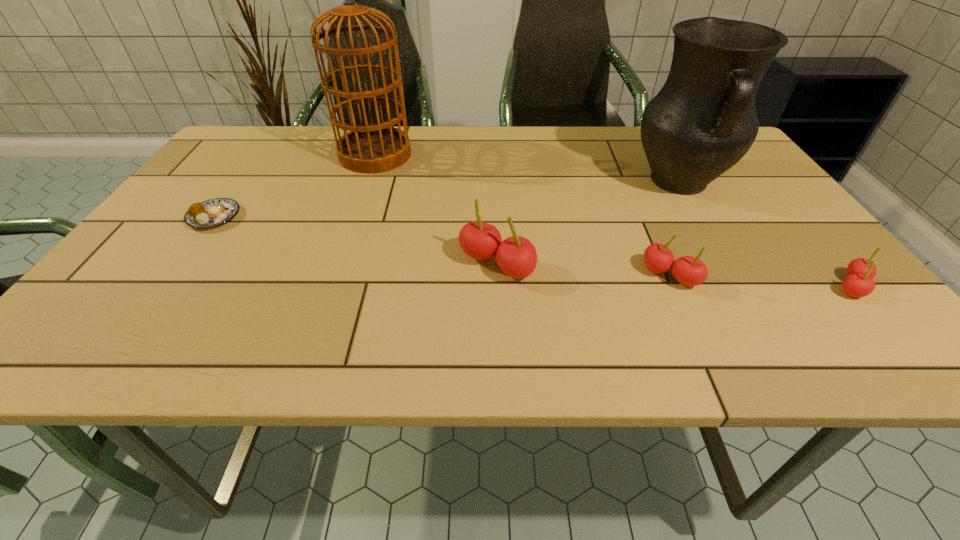
Find the location of a particular element. The image size is (960, 540). pastry is located at coordinates (210, 213).

Where is `vacant space located 0.060m on the right of the tallest cherry`? Image resolution: width=960 pixels, height=540 pixels. vacant space located 0.060m on the right of the tallest cherry is located at coordinates (564, 265).

Image resolution: width=960 pixels, height=540 pixels. I want to click on free spot located on the right of the second tallest cherry, so click(780, 275).

Find the location of a particular element. vacant area situated 0.380m on the back of the rightmost cherry is located at coordinates (755, 173).

Find the location of a particular element. free region located 0.250m on the right of the birdcage is located at coordinates (500, 155).

Locate an element on the screen. vacant space located on the handle side of the fifth shortest object is located at coordinates (760, 318).

Find the location of a particular element. free space located on the back of the shortest object is located at coordinates (235, 189).

Where is `birdcage at the far edge`? The image size is (960, 540). birdcage at the far edge is located at coordinates (377, 148).

Find the location of a particular element. This screenshot has width=960, height=540. pitcher that is positioned at the far edge is located at coordinates (702, 122).

Locate an element on the screen. Image resolution: width=960 pixels, height=540 pixels. object present at the left edge is located at coordinates (210, 213).